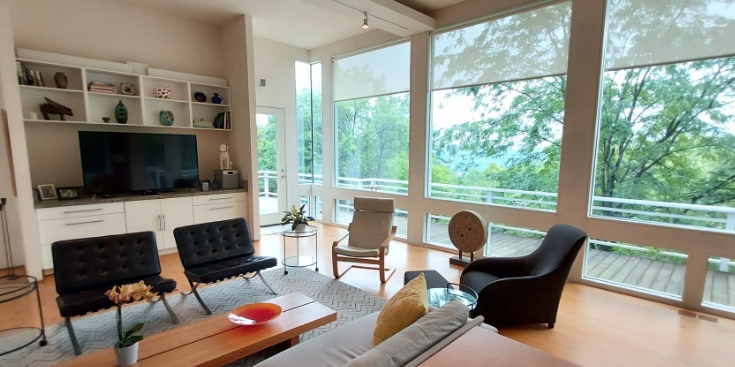
This screenshot has width=735, height=367. In order to click on living room in this screenshot , I will do `click(175, 215)`.